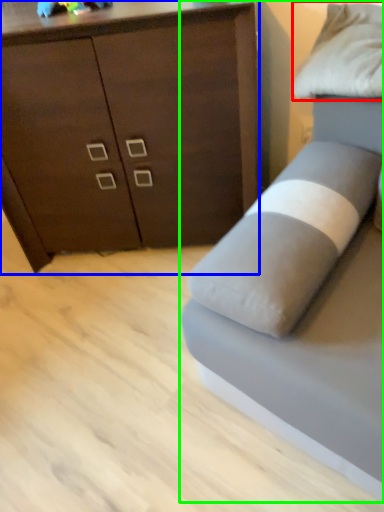
Question: Based on their relative distances, which object is farther from pillow (highlighted by a red box)? Choose from chest of drawers (highlighted by a blue box) and studio couch (highlighted by a green box).

Choices:
 (A) chest of drawers
 (B) studio couch

Answer: (A)